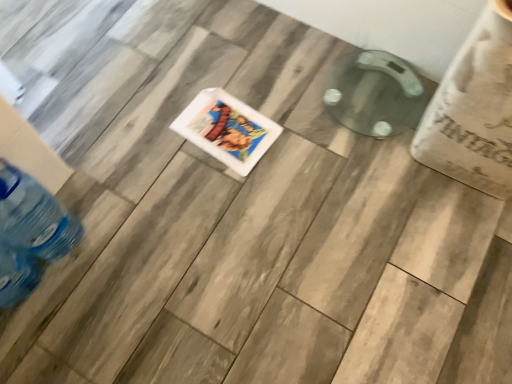
Where is `empty space that is ontop of white glossy comic book at center (from a real-world perspective)`? This screenshot has width=512, height=384. empty space that is ontop of white glossy comic book at center (from a real-world perspective) is located at coordinates (227, 130).